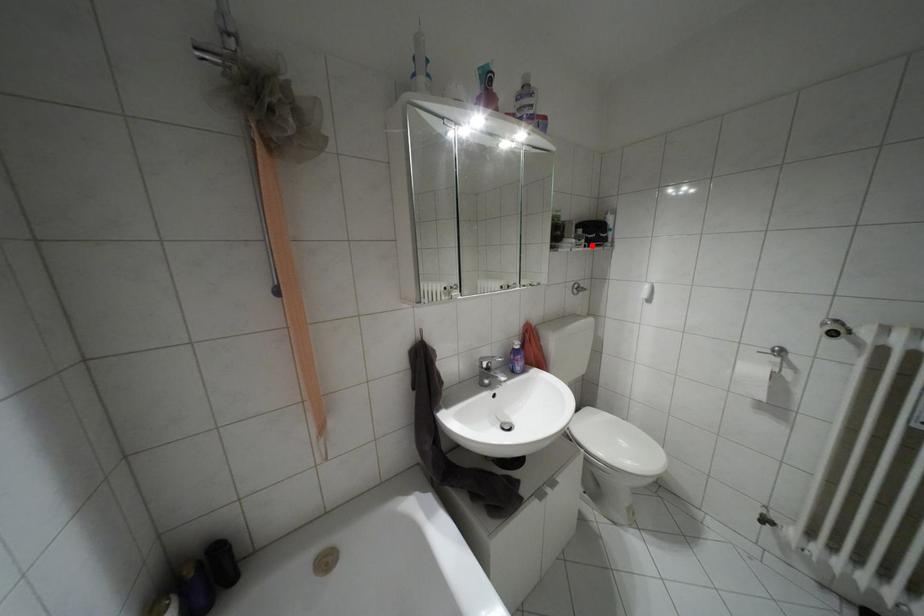
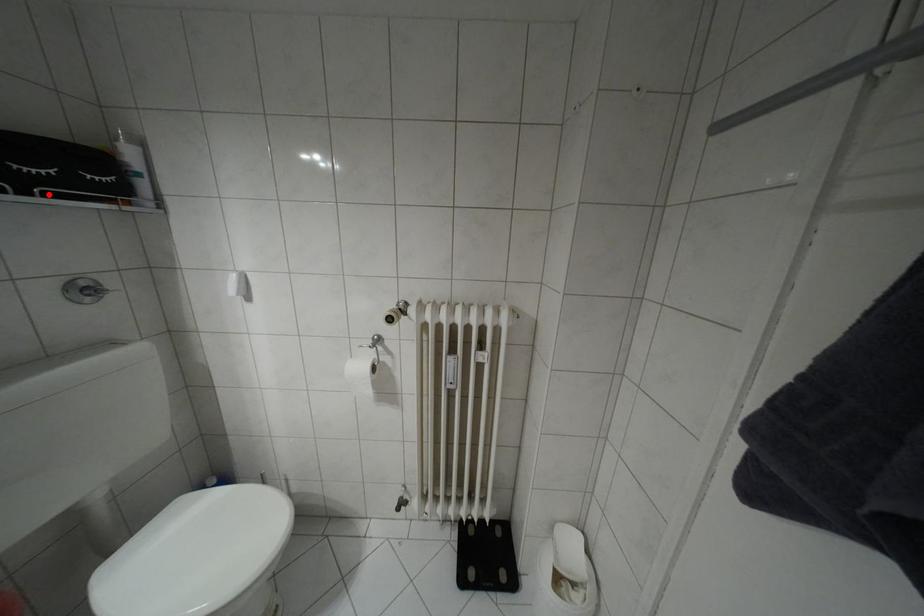
I am providing you with two images of the same scene from different viewpoints. A red point is marked on the first image and another point is marked on the second image. Is the marked point in image1 the same physical position as the marked point in image2?

Yes